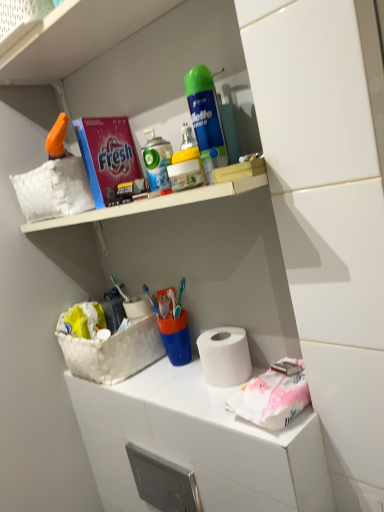
Question: Relative to pink paper at lower right, is white plastic spray can at upper center in front or behind?

Choices:
 (A) front
 (B) behind

Answer: (B)

Question: Would you say white plastic spray can at upper center is to the left or to the right of pink paper at lower right in the picture?

Choices:
 (A) left
 (B) right

Answer: (A)

Question: Considering the real-world distances, which object is farthest from the green matte shaving cream can at upper center, the first cleaning product viewed from the top?

Choices:
 (A) white matte paper towel at center
 (B) white plastic spray can at upper center
 (C) white woven basket at lower left
 (D) pink cardboard box at upper left
 (E) white woven basket at upper left

Answer: (C)

Question: Considering the real-world distances, which object is closest to the white matte toilet paper at lower center?

Choices:
 (A) pink cardboard box at upper left
 (B) green matte shaving cream can at upper center, the second cleaning product positioned from the bottom
 (C) yellow matte spray can at upper center, the 1th cleaning product when ordered from bottom to top
 (D) white woven basket at lower left
 (E) white woven basket at upper left

Answer: (D)